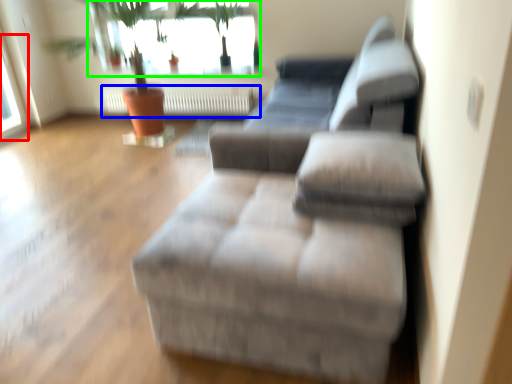
Question: Estimate the real-world distances between objects in this image. Which object is farther from window (highlighted by a red box), radiator (highlighted by a blue box) or window (highlighted by a green box)?

Choices:
 (A) radiator
 (B) window

Answer: (A)